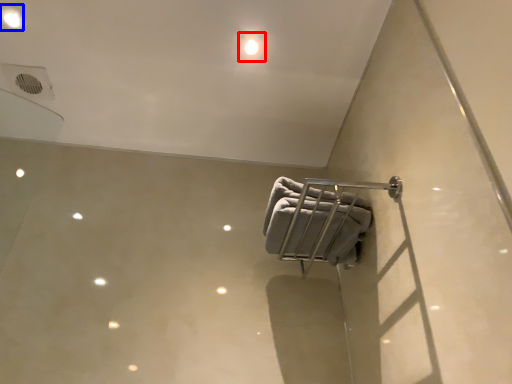
Question: Among these objects, which one is farthest to the camera, dot (highlighted by a red box) or dot (highlighted by a blue box)?

Choices:
 (A) dot
 (B) dot

Answer: (A)